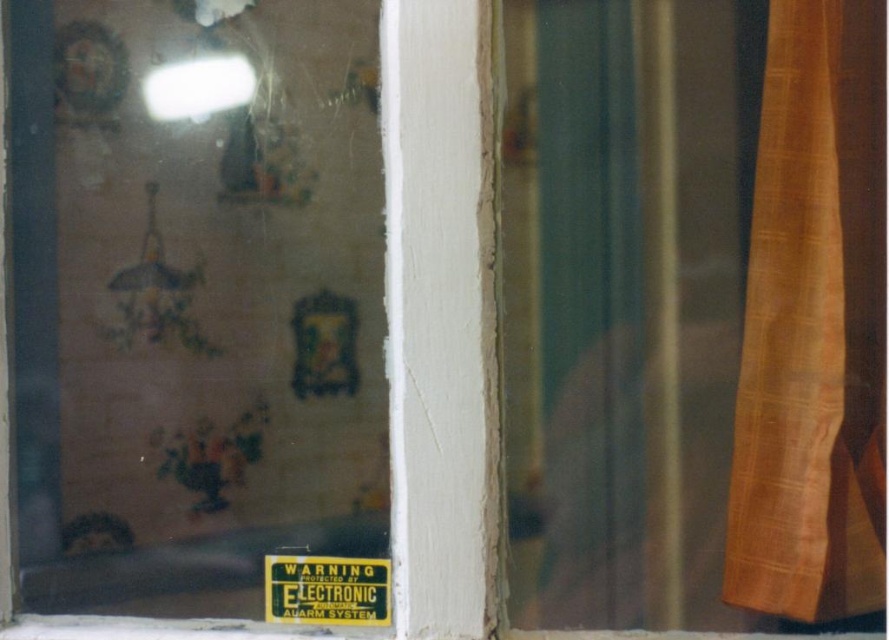
In the scene shown: You are a window cleaner with a 16 inch wide ladder. You need to clean the transparent glass window at upper left and the orange woven fabric curtain at right. Can your ladder reach both objects without moving it?

The transparent glass window at upper left and orange woven fabric curtain at right are 17.60 inches apart from each other. Since your ladder is 16 inches wide, it cannot span the distance between them. You will need to move the ladder to clean both areas.

You are standing outside the window and see two points marked on the wall inside the room. The first point is at coordinates point (861, 234) and the second is at point (335, 576). Which point is closer to you?

Point (861, 234) is in front of point (335, 576), so it is closer to you.